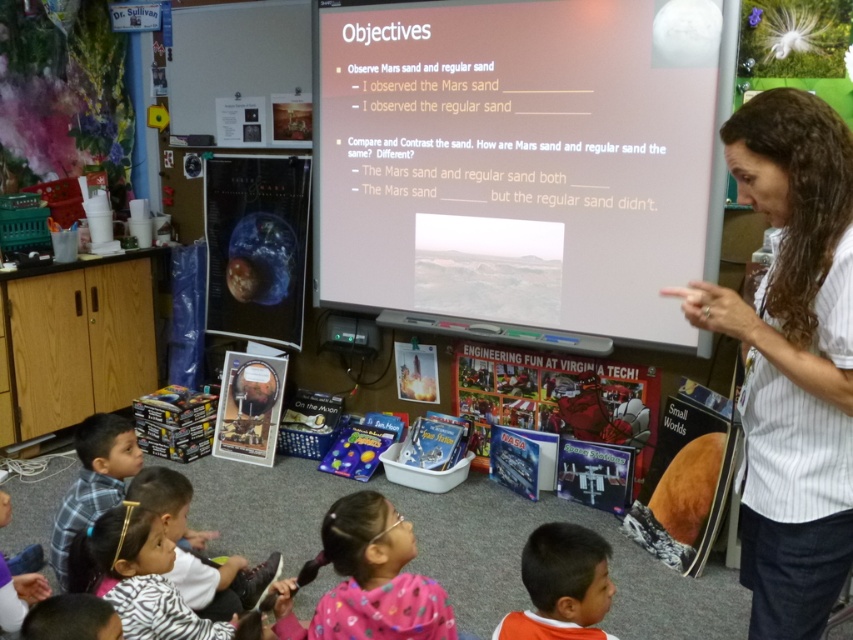
Question: Which of the following is the farthest from the observer?

Choices:
 (A) pink fabric at lower center
 (B) brown hair at upper right
 (C) orange fabric shirt at lower center

Answer: (A)

Question: Which point is closer to the camera?

Choices:
 (A) (764, 429)
 (B) (165, 550)
 (C) (572, 584)
 (D) (410, 600)

Answer: (A)

Question: Considering the real-world distances, which object is farthest from the zebra print sweater at lower left?

Choices:
 (A) brown hair at upper right
 (B) orange fabric shirt at lower center

Answer: (A)

Question: Is zebra print sweater at lower left closer to camera compared to orange fabric shirt at lower center?

Choices:
 (A) no
 (B) yes

Answer: (A)

Question: Does brown hair at upper right appear on the left side of orange fabric shirt at lower center?

Choices:
 (A) yes
 (B) no

Answer: (B)

Question: In this image, where is brown hair at upper right located relative to pink fabric at lower center?

Choices:
 (A) left
 (B) right

Answer: (B)